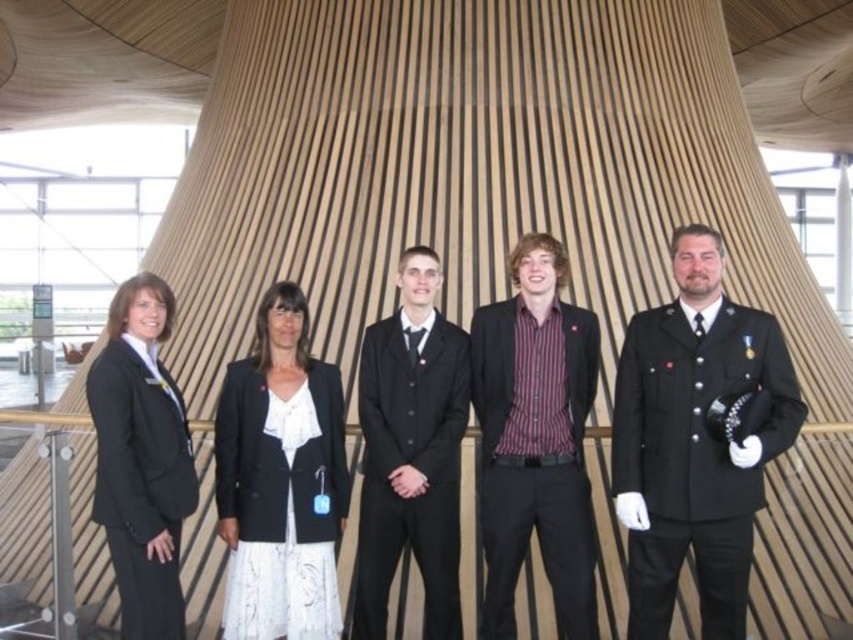
Can you confirm if shiny black uniform at right is smaller than black satin suit at center?

No, shiny black uniform at right is not smaller than black satin suit at center.

Who is more forward, (711,497) or (433,426)?

Point (711,497) is in front.

This screenshot has height=640, width=853. Identify the location of shiny black uniform at right. (694, 442).

At what (x,y) coordinates should I click in order to perform the action: click on shiny black uniform at right. Please return your answer as a coordinate pair (x, y). This screenshot has height=640, width=853. Looking at the image, I should click on (694, 442).

Does black matte blazer at center have a larger size compared to black satin suit at center?

Indeed, black matte blazer at center has a larger size compared to black satin suit at center.

Does point (283, 310) come in front of point (367, 380)?

No, it is behind (367, 380).

Identify the location of black matte blazer at center. (280, 480).

Is black matte blazer at center behind black fabric suit at left?

Yes, black matte blazer at center is further from the viewer.

Who is more forward, (332,516) or (135,307)?

Point (332,516) is more forward.

Is point (334, 634) closer to viewer compared to point (119, 342)?

Yes.

The height and width of the screenshot is (640, 853). Find the location of `black matte blazer at center`. black matte blazer at center is located at coordinates (280, 480).